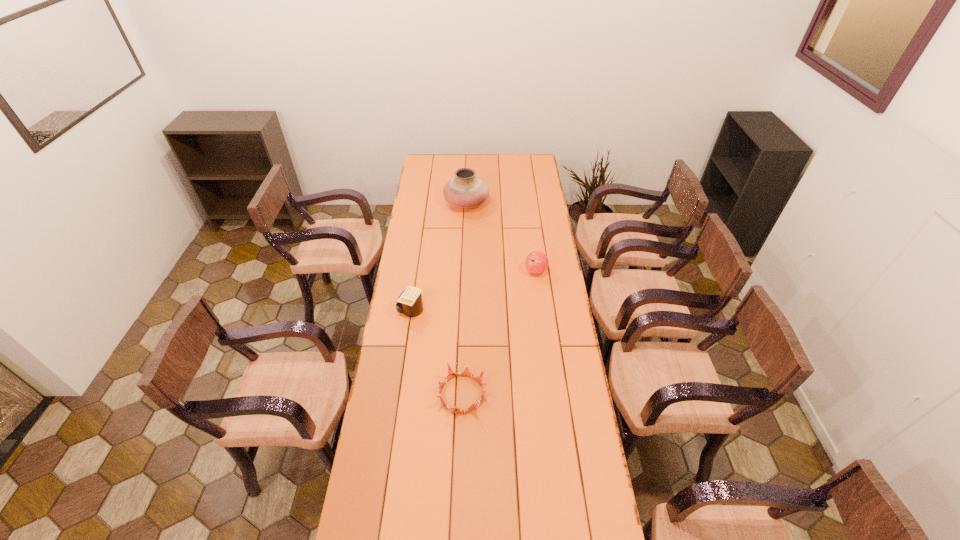
You are a GUI agent. You are given a task and a screenshot of the screen. Output one action in this format:
    pyautogui.click(x=<x>, y=<y>)
    Task: Click on the tallest object
    
    Given the screenshot: What is the action you would take?
    pyautogui.click(x=465, y=190)

Find the location of a particular element. The image size is (960, 540). pottery is located at coordinates (465, 190).

The height and width of the screenshot is (540, 960). I want to click on apple, so click(536, 262).

Image resolution: width=960 pixels, height=540 pixels. I want to click on the second farthest object, so click(536, 262).

Locate an element on the screen. the second nearest object is located at coordinates (409, 302).

The height and width of the screenshot is (540, 960). What are the coordinates of `the leftmost object` in the screenshot? It's located at (409, 302).

Locate an element on the screen. The image size is (960, 540). the nearest object is located at coordinates (466, 372).

Where is `the shortest object`? the shortest object is located at coordinates (466, 372).

Image resolution: width=960 pixels, height=540 pixels. I want to click on free space located 0.350m on the back of the tallest object, so click(468, 159).

Image resolution: width=960 pixels, height=540 pixels. What are the coordinates of `free space located 0.360m on the left of the rightmost object` in the screenshot? It's located at pyautogui.click(x=448, y=271).